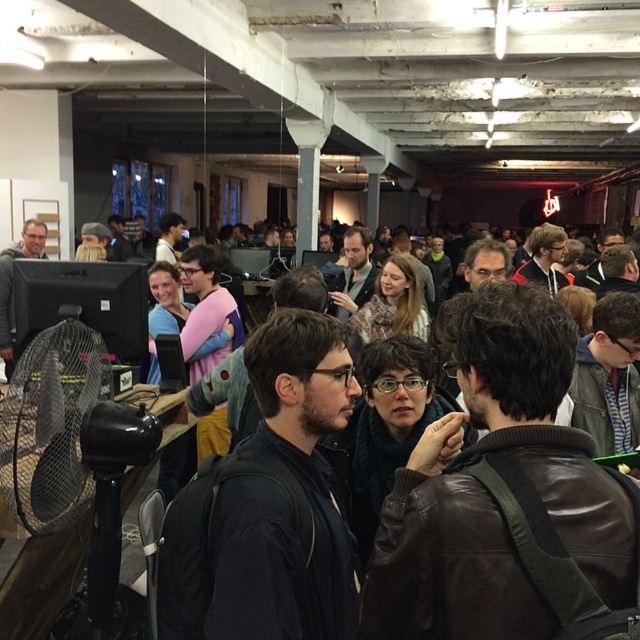
You are standing in the scene and want to hand a document to the person wearing the leather jacket at center. However, there is a matte black monitor at left in your path. Can you reach the person without moving the monitor?

The leather jacket at center is closer to the viewer than the matte black monitor at left, so you can reach the person wearing the leather jacket at center without needing to move the matte black monitor at left since it is further away.

You are a guest at the event and want to take a photo of the black matte jacket at center without including the matte black monitor at left in the frame. Is this possible given their positions?

The black matte jacket at center is positioned on the right side of the matte black monitor at left. Therefore, by angling the camera to the right of the monitor, you can capture the jacket without the monitor in the frame.

You are organizing a photo shoot and need to arrange two jackets, the leather jacket at center and the matte black jacket at center, on a shelf. The shelf has a height limit of 1 meter. Can both jackets be placed on the shelf without exceeding the height limit?

The leather jacket at center is taller than the matte black jacket at center. Since the shelf has a height limit of 1 meter, both jackets can be placed on the shelf as long as the combined height of both jackets does not exceed the limit. However, without knowing the exact heights of each jacket, it is impossible to determine if they will fit individually or together.